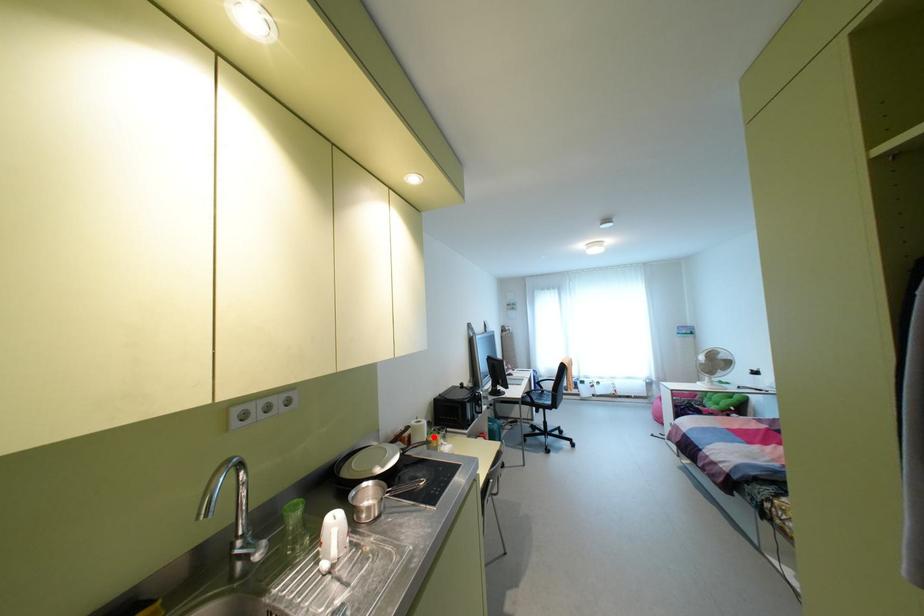
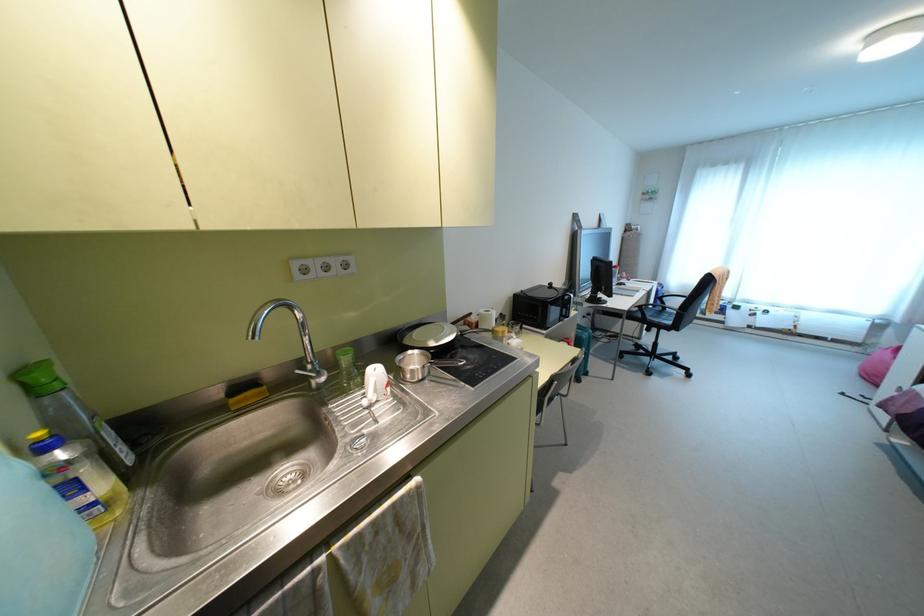
Question: I am providing you with two images of the same scene from different viewpoints. A red point is marked on the first image. At the location where the point appears in image 1, is it still visible in image 2?

Choices:
 (A) Yes
 (B) No

Answer: (A)